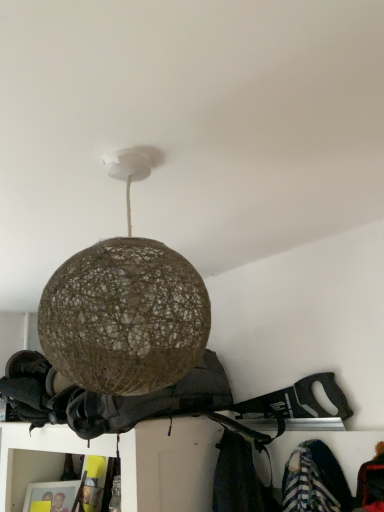
Question: Is brown woven sphere at center turned away from brown woven ball at center?

Choices:
 (A) no
 (B) yes

Answer: (A)

Question: Is the position of brown woven sphere at center more distant than that of brown woven ball at center?

Choices:
 (A) no
 (B) yes

Answer: (A)

Question: Can you confirm if brown woven sphere at center is bigger than brown woven ball at center?

Choices:
 (A) yes
 (B) no

Answer: (B)

Question: From a real-world perspective, is brown woven sphere at center located beneath brown woven ball at center?

Choices:
 (A) yes
 (B) no

Answer: (B)

Question: Does brown woven sphere at center have a greater width compared to brown woven ball at center?

Choices:
 (A) no
 (B) yes

Answer: (A)

Question: Is brown woven sphere at center positioned far away from brown woven ball at center?

Choices:
 (A) no
 (B) yes

Answer: (A)

Question: Does brown woven ball at center have a greater width compared to brown woven sphere at center?

Choices:
 (A) no
 (B) yes

Answer: (B)

Question: Considering the relative positions of brown woven ball at center and brown woven sphere at center in the image provided, is brown woven ball at center to the left of brown woven sphere at center from the viewer's perspective?

Choices:
 (A) no
 (B) yes

Answer: (B)

Question: Is brown woven ball at center taller than brown woven sphere at center?

Choices:
 (A) yes
 (B) no

Answer: (B)

Question: Does brown woven ball at center have a lesser width compared to brown woven sphere at center?

Choices:
 (A) no
 (B) yes

Answer: (A)

Question: From the image's perspective, is brown woven ball at center on brown woven sphere at center?

Choices:
 (A) yes
 (B) no

Answer: (B)

Question: Can you see brown woven ball at center touching brown woven sphere at center?

Choices:
 (A) yes
 (B) no

Answer: (B)

Question: Is point (117, 170) positioned closer to the camera than point (120, 408)?

Choices:
 (A) farther
 (B) closer

Answer: (B)